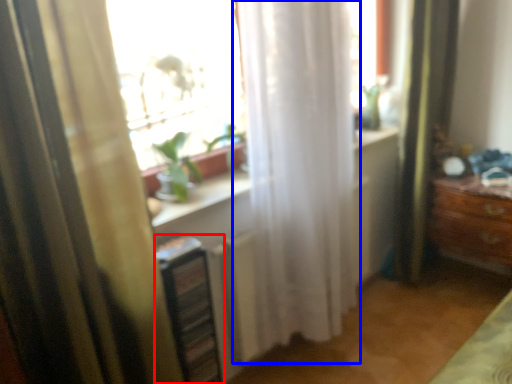
Question: Which of the following is the farthest to the observer, shelf (highlighted by a red box) or curtain (highlighted by a blue box)?

Choices:
 (A) shelf
 (B) curtain

Answer: (A)